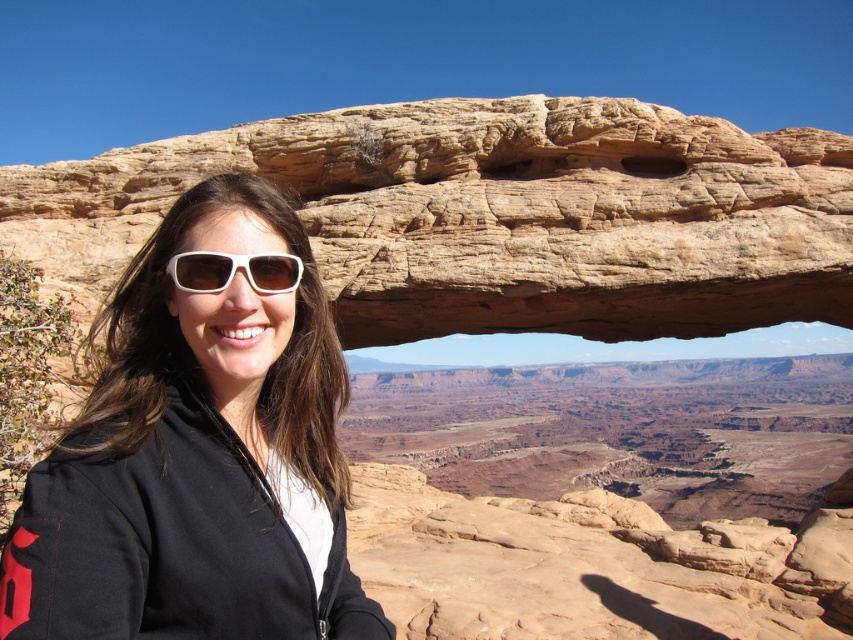
You are a geologist analyzing the image of the rustic sandstone arch at center. Based on its position at coordinates 0.338, 0.583, would you estimate that the arch is closer to the foreground or the background of the scene?

The rustic sandstone arch at center is located at point (496, 216), which places it centrally in the image. Since the person is positioned on the left side of the frame and the arch is at the center, it is likely part of the midground, between the foreground person and the distant canyon background.

You are a photographer trying to capture the rustic sandstone arch at center and the matte black jacket at left in the same frame. Based on their positions, which object should you adjust your camera to focus on first to ensure both are in the shot?

The rustic sandstone arch at center is to the right of the matte black jacket at left. To ensure both are in the shot, focus on the matte black jacket at left first since it is closer to the left edge of the frame, allowing you to position it and include the arch to its right.

You are a photographer planning to take a portrait of the person wearing the matte black jacket at left and the white matte sunglasses at center. You want to ensure that both items are clearly visible in the photo. Given that your camera has a minimum focus distance of 4 meters, will you need to adjust your position to capture both objects in focus?

The matte black jacket at left is 4.45 meters away from the white matte sunglasses at center. Since the minimum focus distance of your camera is 4 meters, the distance between the two objects is sufficient, so you can capture both in focus without needing to adjust your position.